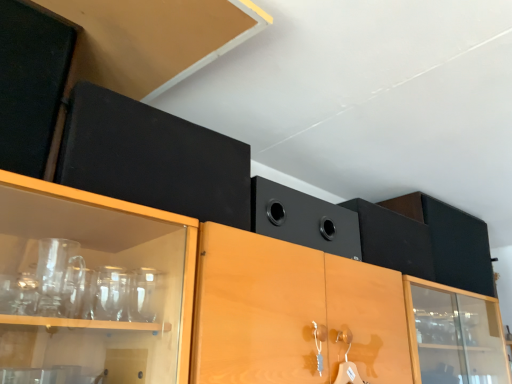
What is the approximate height of matte black cabinet at upper left?

It is 10.35 inches.

Find the location of a particular element. Image resolution: width=512 pixels, height=384 pixels. matte black cabinet at upper left is located at coordinates (152, 158).

This screenshot has height=384, width=512. Describe the element at coordinates (152, 158) in the screenshot. I see `matte black cabinet at upper left` at that location.

Identify the location of black matte speaker at upper center. (303, 219).

The width and height of the screenshot is (512, 384). What do you see at coordinates (303, 219) in the screenshot?
I see `black matte speaker at upper center` at bounding box center [303, 219].

Identify the location of matte black cabinet at upper left. (152, 158).

Between matte black cabinet at upper left and black matte speaker at upper center, which one appears on the left side from the viewer's perspective?

matte black cabinet at upper left is more to the left.

Is matte black cabinet at upper left in front of or behind black matte speaker at upper center in the image?

Result: matte black cabinet at upper left is in front of black matte speaker at upper center.

Is point (64, 129) closer or farther from the camera than point (259, 218)?

Point (64, 129) is closer to the camera than point (259, 218).

From the image's perspective, is matte black cabinet at upper left located beneath black matte speaker at upper center?

No, from the image's perspective, matte black cabinet at upper left is not beneath black matte speaker at upper center.

From a real-world perspective, is matte black cabinet at upper left located beneath black matte speaker at upper center?

No, from a real-world perspective, matte black cabinet at upper left is not under black matte speaker at upper center.

Is matte black cabinet at upper left wider or thinner than black matte speaker at upper center?

Clearly, matte black cabinet at upper left has less width compared to black matte speaker at upper center.

Who is shorter, matte black cabinet at upper left or black matte speaker at upper center?

black matte speaker at upper center is shorter.

Between matte black cabinet at upper left and black matte speaker at upper center, which one has smaller size?

With smaller size is matte black cabinet at upper left.

Is matte black cabinet at upper left spatially inside black matte speaker at upper center, or outside of it?

matte black cabinet at upper left is outside black matte speaker at upper center.

In the scene shown: Are matte black cabinet at upper left and black matte speaker at upper center making contact?

They are not placed beside each other.

Could you tell me if matte black cabinet at upper left is turned towards black matte speaker at upper center?

No, matte black cabinet at upper left is not facing towards black matte speaker at upper center.

What's the angular difference between matte black cabinet at upper left and black matte speaker at upper center's facing directions?

There is a 0.00403-degree angle between the facing directions of matte black cabinet at upper left and black matte speaker at upper center.

This screenshot has width=512, height=384. There is a black matte speaker at upper center. Identify the location of cabinetry above it (from a real-world perspective). (152, 158).

Visually, is black matte speaker at upper center positioned to the left or to the right of matte black cabinet at upper left?

black matte speaker at upper center is to the right of matte black cabinet at upper left.

Is the depth of black matte speaker at upper center less than that of matte black cabinet at upper left?

No, black matte speaker at upper center is further to the viewer.

Is point (324, 224) positioned after point (245, 152)?

Yes, point (324, 224) is behind point (245, 152).

From the image's perspective, is black matte speaker at upper center located beneath matte black cabinet at upper left?

Yes, from the image's perspective, black matte speaker at upper center is below matte black cabinet at upper left.

From a real-world perspective, which is physically below, black matte speaker at upper center or matte black cabinet at upper left?

In real-world perspective, black matte speaker at upper center is lower.

Which object is wider, black matte speaker at upper center or matte black cabinet at upper left?

With larger width is black matte speaker at upper center.

Based on the photo, considering the relative sizes of black matte speaker at upper center and matte black cabinet at upper left in the image provided, is black matte speaker at upper center shorter than matte black cabinet at upper left?

Correct, black matte speaker at upper center is not as tall as matte black cabinet at upper left.

Does black matte speaker at upper center have a larger size compared to matte black cabinet at upper left?

Yes, black matte speaker at upper center is bigger than matte black cabinet at upper left.

Would you say black matte speaker at upper center contains matte black cabinet at upper left?

That's incorrect, matte black cabinet at upper left is not inside black matte speaker at upper center.

Is black matte speaker at upper center not near matte black cabinet at upper left?

Actually, black matte speaker at upper center and matte black cabinet at upper left are a little close together.

Is black matte speaker at upper center facing towards matte black cabinet at upper left?

No, black matte speaker at upper center is not oriented towards matte black cabinet at upper left.

Looking at this image, what's the angular difference between black matte speaker at upper center and matte black cabinet at upper left's facing directions?

There is a 0.00403-degree angle between the facing directions of black matte speaker at upper center and matte black cabinet at upper left.

The width and height of the screenshot is (512, 384). I want to click on speaker directly beneath the matte black cabinet at upper left (from a real-world perspective), so click(303, 219).

Identify the location of cabinetry above the black matte speaker at upper center (from a real-world perspective). This screenshot has height=384, width=512. (152, 158).

You are a GUI agent. You are given a task and a screenshot of the screen. Output one action in this format:
    pyautogui.click(x=<x>, y=<y>)
    Task: Click on the speaker on the right side of matte black cabinet at upper left
    This screenshot has height=384, width=512.
    Given the screenshot: What is the action you would take?
    pyautogui.click(x=303, y=219)